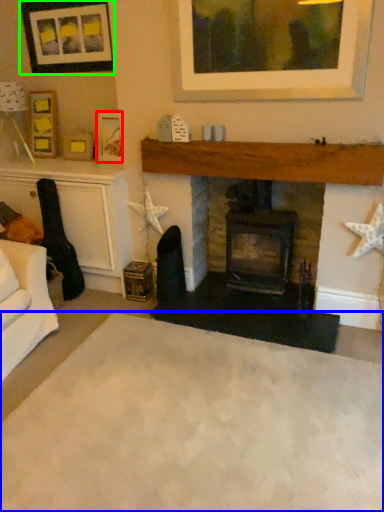
Question: Based on their relative distances, which object is nearer to picture frame (highlighted by a red box)? Choose from plain (highlighted by a blue box) and picture frame (highlighted by a green box).

Choices:
 (A) plain
 (B) picture frame

Answer: (B)